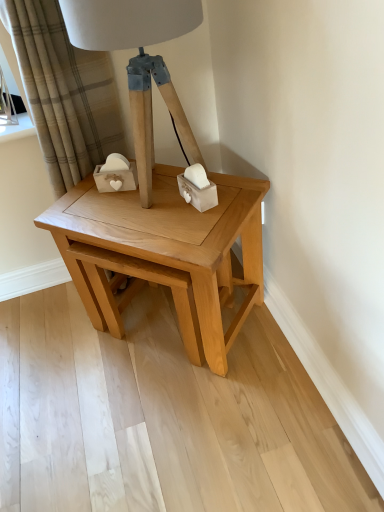
What are the coordinates of `free spot in front of matte wood table lamp at center` in the screenshot? It's located at (175, 227).